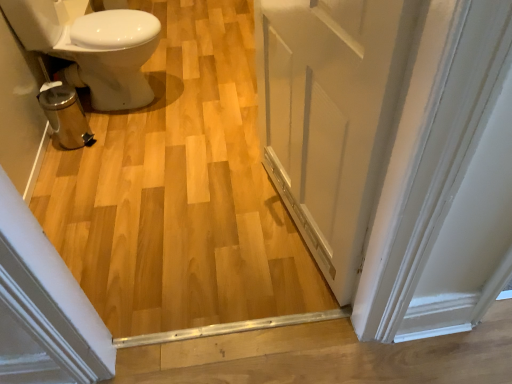
Question: Does white glossy bidet at left appear on the left side of white painted wood door at center?

Choices:
 (A) no
 (B) yes

Answer: (B)

Question: From the image's perspective, is white glossy bidet at left located above white painted wood door at center?

Choices:
 (A) yes
 (B) no

Answer: (A)

Question: Considering the relative sizes of white glossy bidet at left and white painted wood door at center in the image provided, is white glossy bidet at left shorter than white painted wood door at center?

Choices:
 (A) yes
 (B) no

Answer: (A)

Question: Is white glossy bidet at left outside white painted wood door at center?

Choices:
 (A) yes
 (B) no

Answer: (A)

Question: Is white glossy bidet at left aimed at white painted wood door at center?

Choices:
 (A) yes
 (B) no

Answer: (B)

Question: Is white glossy bidet at left placed right next to white painted wood door at center?

Choices:
 (A) yes
 (B) no

Answer: (B)

Question: Is white painted wood door at center outside white glossy bidet at left?

Choices:
 (A) yes
 (B) no

Answer: (A)

Question: Considering the relative sizes of white painted wood door at center and white glossy bidet at left in the image provided, is white painted wood door at center bigger than white glossy bidet at left?

Choices:
 (A) no
 (B) yes

Answer: (A)

Question: Is white painted wood door at center next to white glossy bidet at left and touching it?

Choices:
 (A) no
 (B) yes

Answer: (A)

Question: Is white painted wood door at center positioned far away from white glossy bidet at left?

Choices:
 (A) no
 (B) yes

Answer: (B)

Question: Is white painted wood door at center taller than white glossy bidet at left?

Choices:
 (A) no
 (B) yes

Answer: (B)

Question: Does white painted wood door at center lie in front of white glossy bidet at left?

Choices:
 (A) yes
 (B) no

Answer: (A)

Question: From the image's perspective, is white painted wood door at center positioned above or below white glossy bidet at left?

Choices:
 (A) below
 (B) above

Answer: (A)